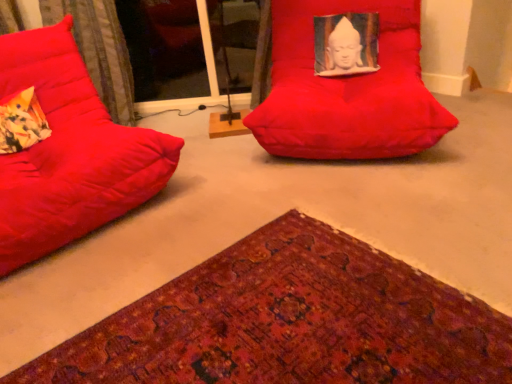
Locate an element on the screen. The width and height of the screenshot is (512, 384). vacant area that is in front of transparent glass door at upper center is located at coordinates (202, 123).